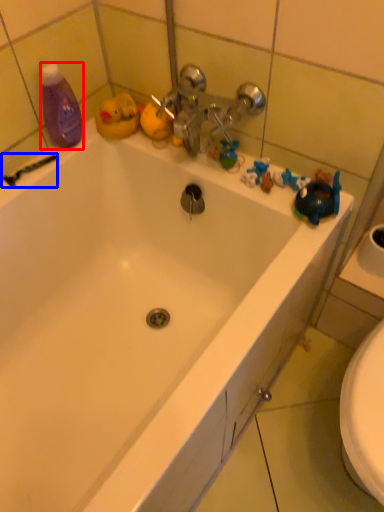
Question: Which object appears closest to the camera in this image, cleaning product (highlighted by a red box) or shower (highlighted by a blue box)?

Choices:
 (A) cleaning product
 (B) shower

Answer: (A)